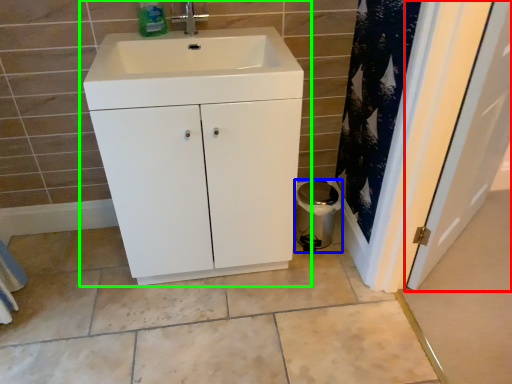
Question: Which object is the farthest from door (highlighted by a red box)? Choose among these: appliance (highlighted by a blue box) or bathroom cabinet (highlighted by a green box).

Choices:
 (A) appliance
 (B) bathroom cabinet

Answer: (B)